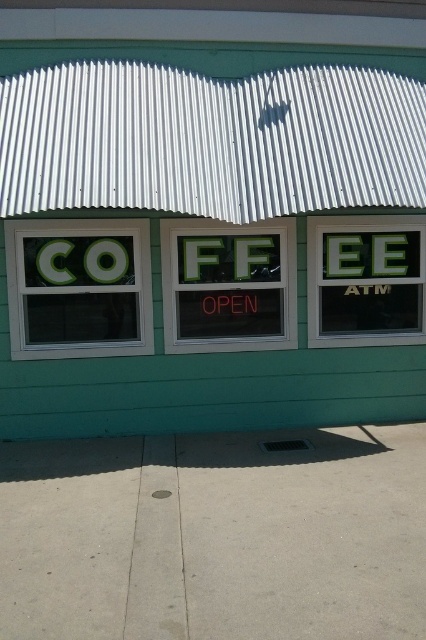
Between point (71, 291) and point (351, 244), which one is positioned behind?

Positioned behind is point (351, 244).

Identify the location of green plastic sign at left. The width and height of the screenshot is (426, 640). (78, 288).

Which is behind, point (192, 240) or point (408, 278)?

The point (408, 278) is behind.

Does green matte signboard at center have a larger size compared to green matte atm sign at right?

Indeed, green matte signboard at center has a larger size compared to green matte atm sign at right.

Which is behind, point (43, 378) or point (388, 292)?

The point (388, 292) is more distant.

At what (x,y) coordinates should I click in order to perform the action: click on green matte signboard at center. Please return your answer as a coordinate pair (x, y). This screenshot has width=426, height=640. Looking at the image, I should click on (210, 216).

Is green matte signboard at center closer to the viewer compared to green plastic sign at left?

Yes, green matte signboard at center is closer to the viewer.

Who is more distant from viewer, (28, 273) or (74, 320)?

The point (74, 320) is more distant.

Is point (322, 54) farther from camera compared to point (101, 266)?

Yes, point (322, 54) is farther from viewer.

What are the coordinates of `green matte signboard at center` in the screenshot? It's located at (210, 216).